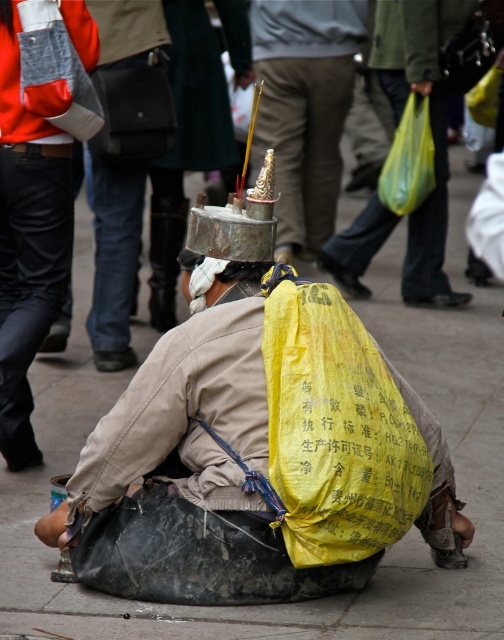
Can you confirm if metallic gold incense burner at center is shorter than yellow fabric bag at center?

Yes, metallic gold incense burner at center is shorter than yellow fabric bag at center.

Does point (358, 3) come farther from viewer compared to point (335, 237)?

Yes, point (358, 3) is behind point (335, 237).

At what (x,y) coordinates should I click in order to perform the action: click on metallic gold incense burner at center. Please return your answer as a coordinate pair (x, y). The height and width of the screenshot is (640, 504). Looking at the image, I should click on click(304, 108).

Can you confirm if yellow fabric bag at center is thinner than yellow fabric bag at lower center?

In fact, yellow fabric bag at center might be wider than yellow fabric bag at lower center.

Locate an element on the screen. The height and width of the screenshot is (640, 504). yellow fabric bag at center is located at coordinates (430, 125).

Who is more forward, (364, 285) or (135, 410)?

Point (135, 410) is in front.

Where is `yellow fabric bag at center`? yellow fabric bag at center is located at coordinates (430, 125).

Is metallic gold incense burner at center shorter than yellow fabric bag at lower center?

No, metallic gold incense burner at center is not shorter than yellow fabric bag at lower center.

Which is behind, point (301, 109) or point (428, 442)?

Positioned behind is point (301, 109).

Locate an element on the screen. This screenshot has height=640, width=504. metallic gold incense burner at center is located at coordinates (304, 108).